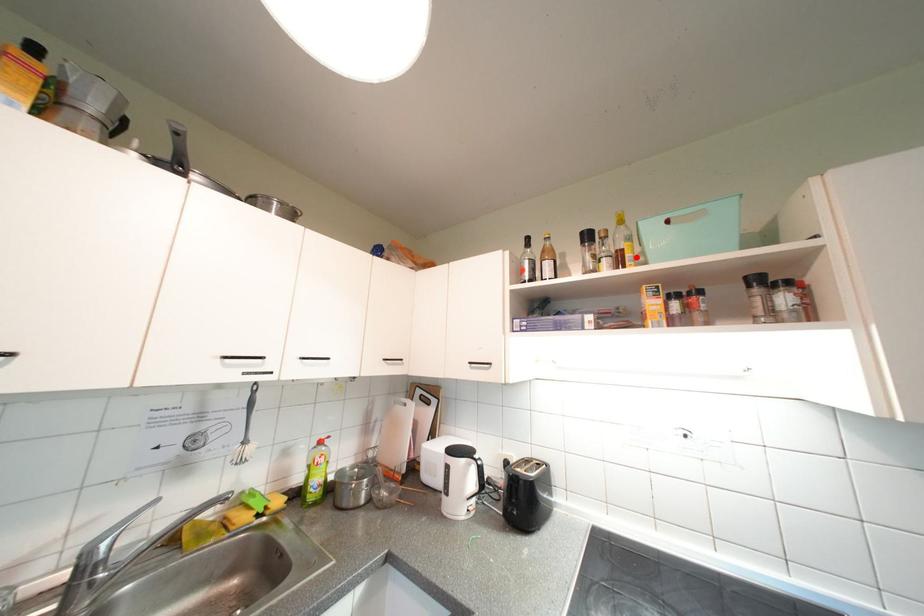
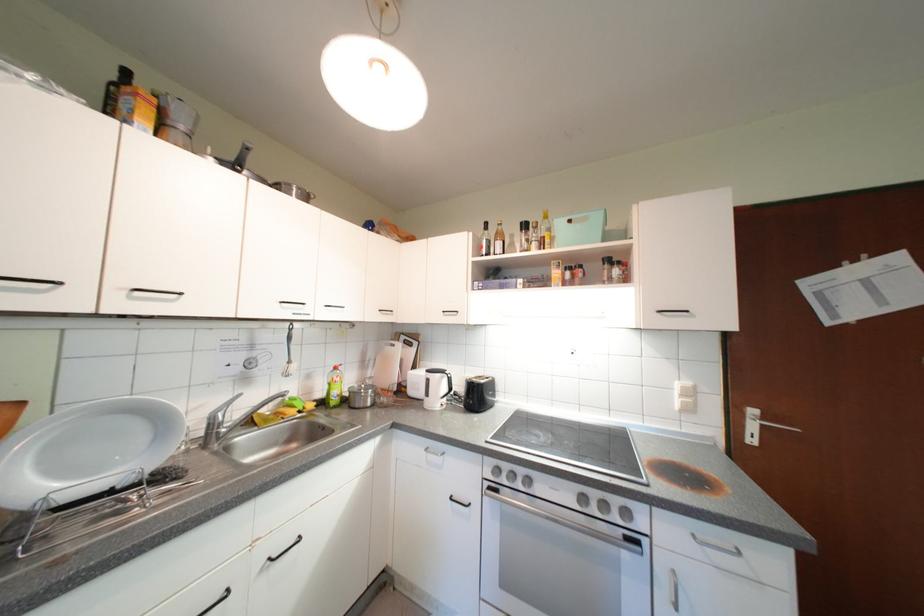
In the second image, find the point that corresponds to the highlighted location in the first image.

(554, 243)